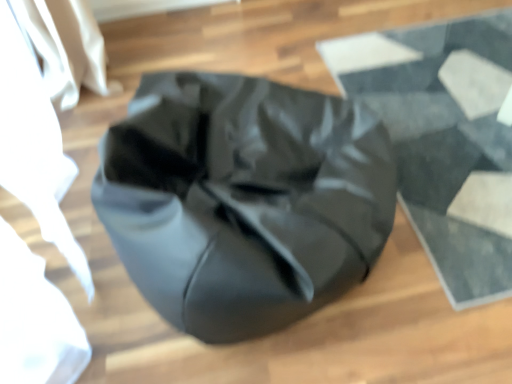
Measure the distance between point (372, 39) and camera.

Point (372, 39) is 1.86 meters from camera.

The width and height of the screenshot is (512, 384). Find the location of `black leather bean bag at center`. black leather bean bag at center is located at coordinates (441, 134).

What do you see at coordinates (441, 134) in the screenshot? The image size is (512, 384). I see `black leather bean bag at center` at bounding box center [441, 134].

Image resolution: width=512 pixels, height=384 pixels. In order to click on black leather bean bag at center in this screenshot , I will do `click(441, 134)`.